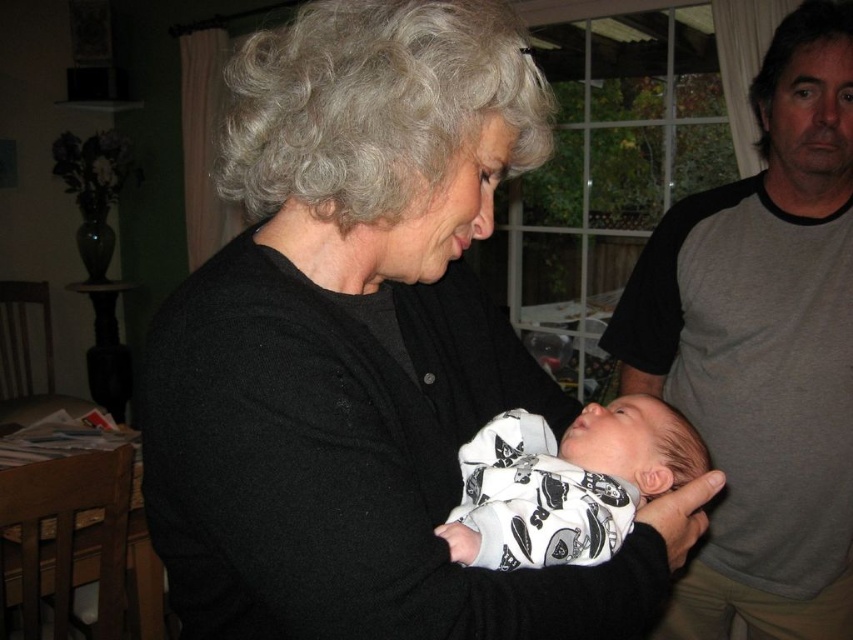
Who is higher up, black soft sweater at center or gray cotton t-shirt at upper right?

Positioned higher is black soft sweater at center.

Which is below, black soft sweater at center or gray cotton t-shirt at upper right?

gray cotton t-shirt at upper right is below.

Is point (375, 624) behind point (659, 358)?

No.

Where is `black soft sweater at center`? Image resolution: width=853 pixels, height=640 pixels. black soft sweater at center is located at coordinates (364, 348).

Which is below, black soft sweater at center or white cotton swaddle at center?

Positioned lower is white cotton swaddle at center.

Which of these two, black soft sweater at center or white cotton swaddle at center, stands taller?

black soft sweater at center

The height and width of the screenshot is (640, 853). Identify the location of black soft sweater at center. (364, 348).

Find the location of a particular element. The height and width of the screenshot is (640, 853). black soft sweater at center is located at coordinates (364, 348).

Looking at this image, who is more forward, (746, 339) or (651, 444)?

Point (651, 444) is in front.

Which is more to the left, gray cotton t-shirt at upper right or white cotton swaddle at center?

white cotton swaddle at center

Is point (776, 397) closer to camera compared to point (636, 444)?

No, (776, 397) is further to viewer.

Identify the location of gray cotton t-shirt at upper right. This screenshot has height=640, width=853. (763, 348).